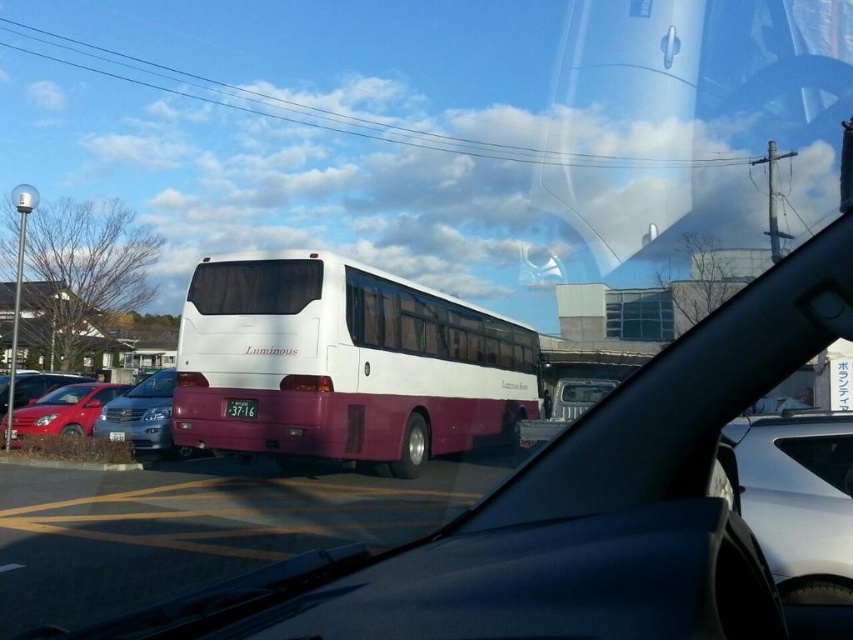
How distant is white matte bus at center from white glossy license plate at center?

white matte bus at center is 8.98 feet from white glossy license plate at center.

Is point (364, 394) closer to camera compared to point (256, 403)?

No.

Locate an element on the screen. This screenshot has width=853, height=640. white matte bus at center is located at coordinates (344, 364).

Can you confirm if white matte bus at center is smaller than satin silver sedan at center?

No, white matte bus at center is not smaller than satin silver sedan at center.

Is white matte bus at center taller than satin silver sedan at center?

Indeed, white matte bus at center has a greater height compared to satin silver sedan at center.

Locate an element on the screen. This screenshot has height=640, width=853. white matte bus at center is located at coordinates (344, 364).

Which of these two, white matte bus at center or shiny red sedan at lower left, stands taller?

white matte bus at center

Which is in front, point (508, 376) or point (0, 435)?

Point (0, 435) is in front.

You are a GUI agent. You are given a task and a screenshot of the screen. Output one action in this format:
    pyautogui.click(x=<x>, y=<y>)
    Task: Click on the white matte bus at center
    
    Given the screenshot: What is the action you would take?
    pyautogui.click(x=344, y=364)